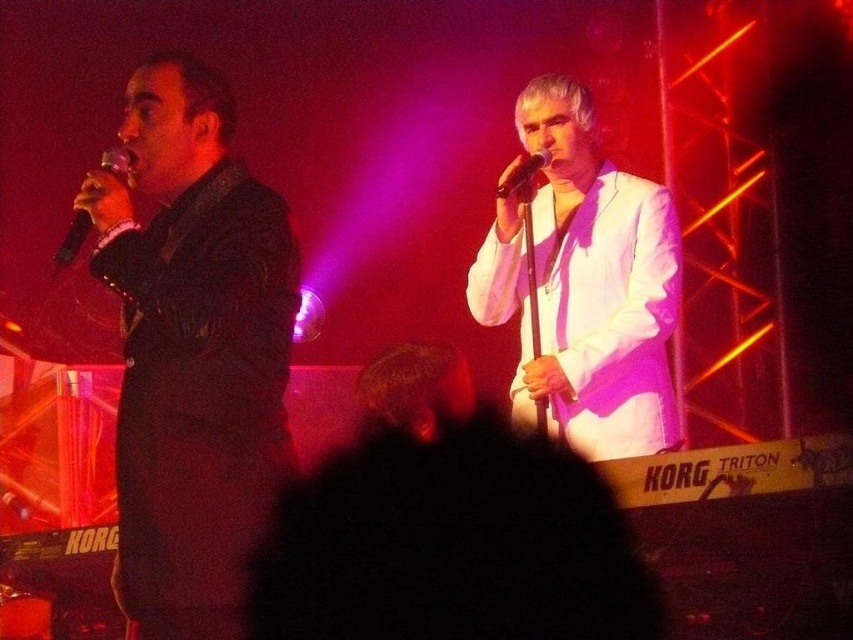
Question: Does matte black suit at left appear on the right side of white satin suit at center?

Choices:
 (A) yes
 (B) no

Answer: (B)

Question: Which object is positioned closest to the white satin suit at center?

Choices:
 (A) matte black suit at left
 (B) black matte microphone at upper center
 (C) black matte microphone at left

Answer: (B)

Question: Which point appears farthest from the camera in this image?

Choices:
 (A) (155, 412)
 (B) (122, 170)

Answer: (B)

Question: Can you confirm if black matte microphone at left is positioned to the right of black matte microphone at upper center?

Choices:
 (A) no
 (B) yes

Answer: (A)

Question: Which point appears farthest from the camera in this image?

Choices:
 (A) (511, 182)
 (B) (80, 230)
 (C) (288, 333)
 (D) (579, 147)

Answer: (D)

Question: Does white satin suit at center appear over black matte microphone at upper center?

Choices:
 (A) yes
 (B) no

Answer: (B)